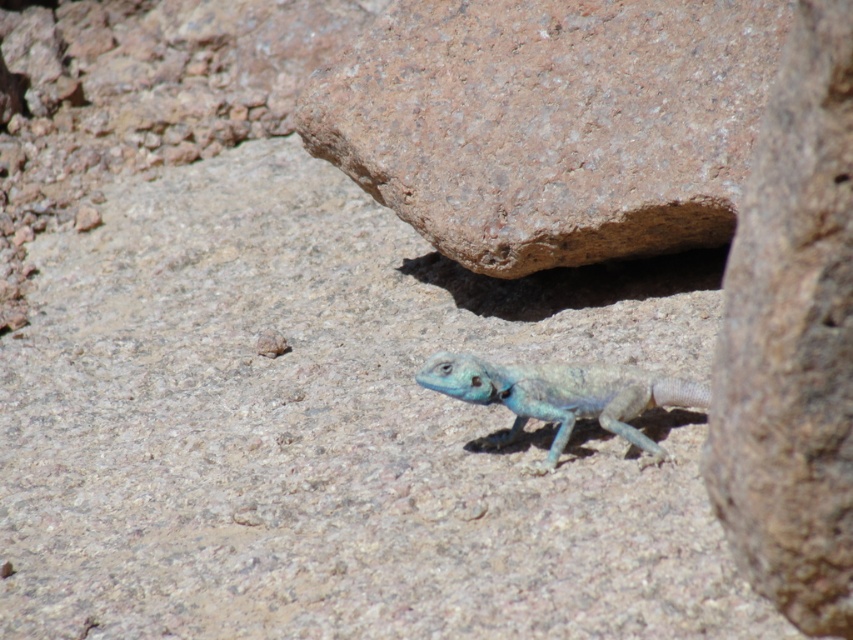
Is rusty stone boulder at upper center positioned before brown rough rock at right?

That is False.

Does rusty stone boulder at upper center appear on the left side of brown rough rock at right?

Yes, rusty stone boulder at upper center is to the left of brown rough rock at right.

Which is in front, point (717, 100) or point (819, 484)?

Point (819, 484)

Locate an element on the screen. rusty stone boulder at upper center is located at coordinates (550, 122).

Is point (759, 477) positioned behind point (508, 378)?

No, it is in front of (508, 378).

Where is `brown rough rock at right`? brown rough rock at right is located at coordinates 792,339.

Does point (763, 356) come closer to viewer compared to point (514, 384)?

Yes, point (763, 356) is in front of point (514, 384).

You are a GUI agent. You are given a task and a screenshot of the screen. Output one action in this format:
    pyautogui.click(x=<x>, y=<y>)
    Task: Click on the brown rough rock at right
    The height and width of the screenshot is (640, 853).
    Given the screenshot: What is the action you would take?
    pyautogui.click(x=792, y=339)

This screenshot has height=640, width=853. What do you see at coordinates (550, 122) in the screenshot?
I see `rusty stone boulder at upper center` at bounding box center [550, 122].

Between point (515, 51) and point (602, 397), which one is positioned in front?

Positioned in front is point (602, 397).

This screenshot has height=640, width=853. Identify the location of rusty stone boulder at upper center. (550, 122).